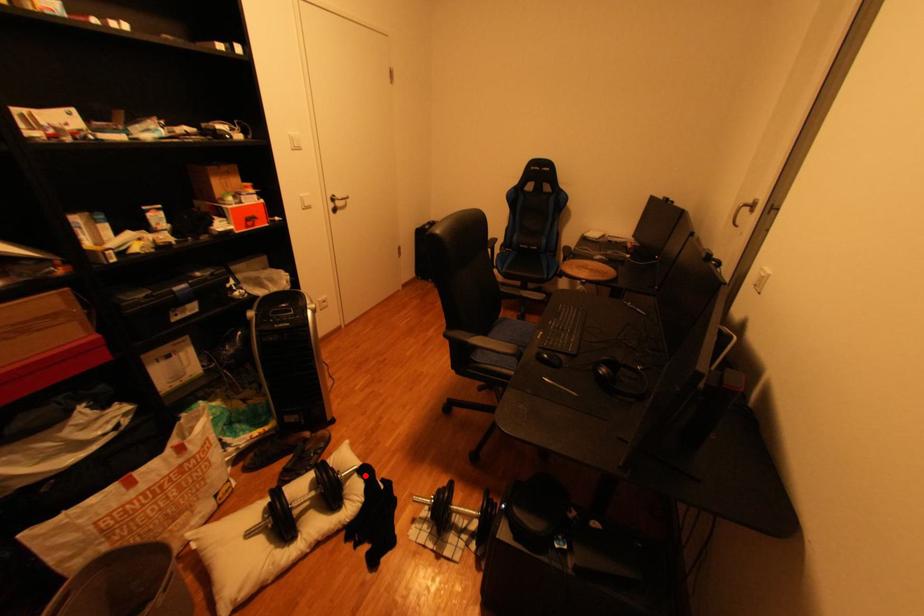
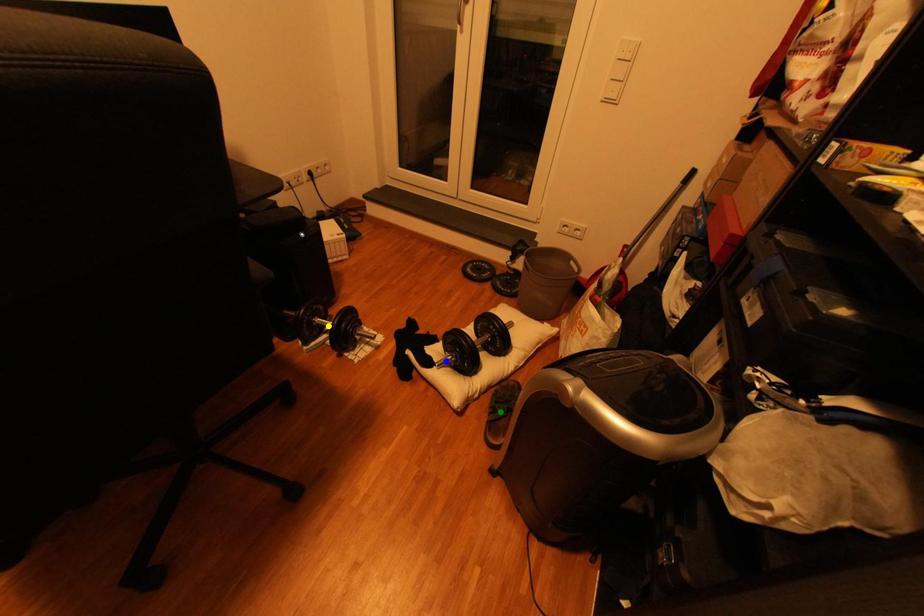
Question: I am providing you with two images of the same scene from different viewpoints. A red point is marked on the first image. You are given multiple points on the second image. Which point in image 2 represents the same 3d spot as the red point in image 1?

Choices:
 (A) yellow point
 (B) blue point
 (C) green point

Answer: (B)